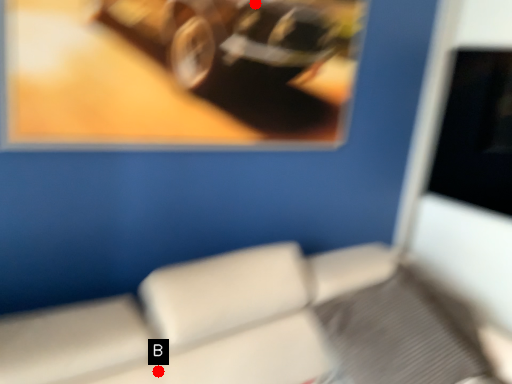
Question: Two points are circled on the image, labeled by A and B beside each circle. Among these points, which one is farthest from the camera?

Choices:
 (A) A is further
 (B) B is further

Answer: (A)